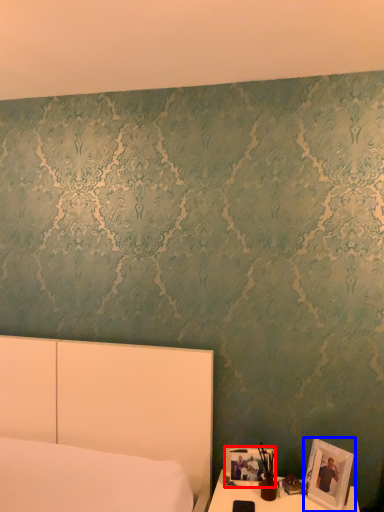
Question: Which point is further to the camera, picture frame (highlighted by a red box) or picture frame (highlighted by a blue box)?

Choices:
 (A) picture frame
 (B) picture frame

Answer: (A)